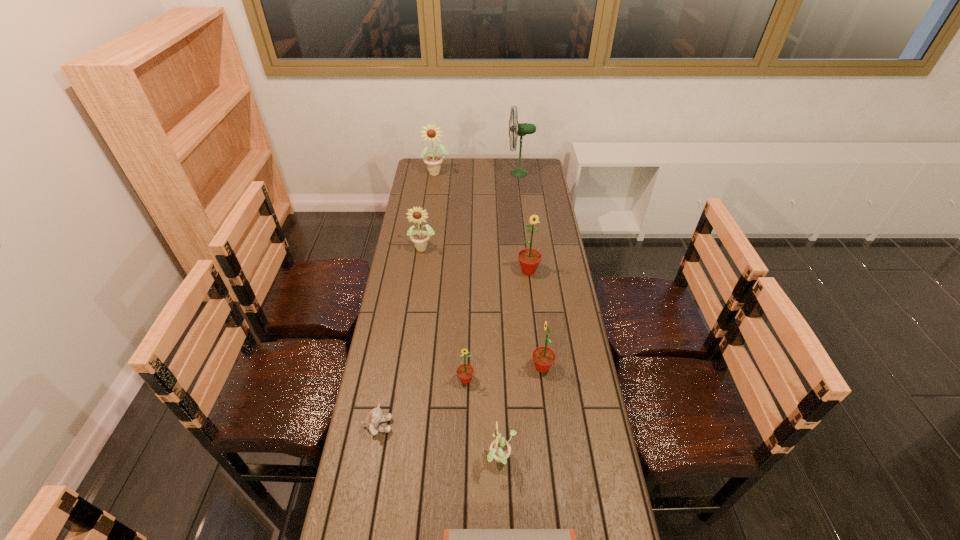
Where is `fan`? The height and width of the screenshot is (540, 960). fan is located at coordinates (519, 129).

I want to click on the tallest object, so click(x=519, y=129).

Locate an element on the screen. The image size is (960, 540). the biggest yellow sunflower is located at coordinates (431, 133).

The width and height of the screenshot is (960, 540). I want to click on the farthest yellow sunflower, so click(x=431, y=133).

Identify the location of the third farthest sunflower. This screenshot has width=960, height=540. (529, 259).

Identify the location of the fourth farthest object. The image size is (960, 540). (529, 259).

Where is `the second smallest green sunflower`? The image size is (960, 540). the second smallest green sunflower is located at coordinates tap(543, 357).

Where is `the fifth nearest sunflower`? The width and height of the screenshot is (960, 540). the fifth nearest sunflower is located at coordinates (420, 238).

You are a GUI agent. You are given a task and a screenshot of the screen. Output one action in this format:
    pyautogui.click(x=<x>, y=<y>)
    Task: Click on the seventh nearest object
    This screenshot has width=960, height=540.
    Given the screenshot: What is the action you would take?
    pyautogui.click(x=420, y=238)

At what (x,y) coordinates should I click in order to perform the action: click on the smallest yellow sunflower. Please return your answer as a coordinate pair (x, y). Image resolution: width=960 pixels, height=540 pixels. Looking at the image, I should click on (500, 449).